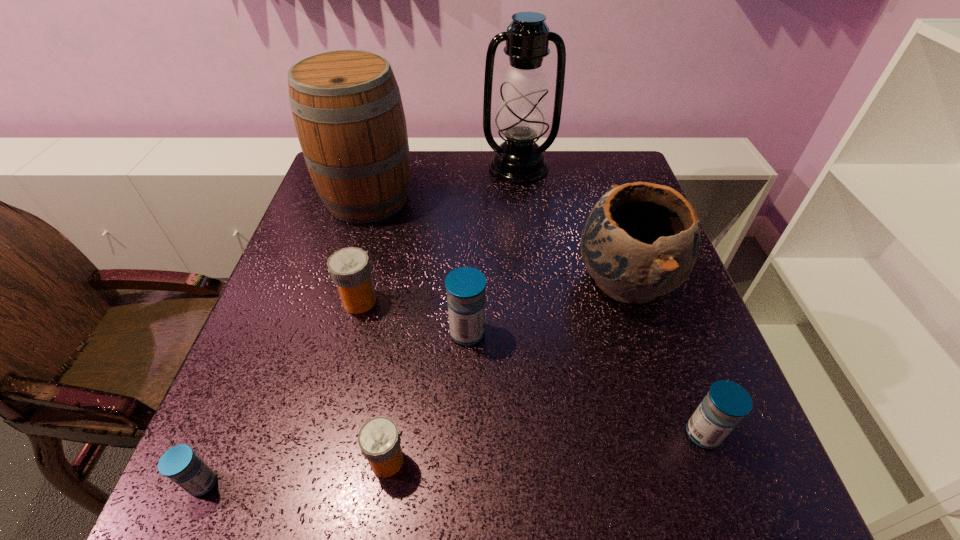
Identify the location of the fifth object from right to left. The height and width of the screenshot is (540, 960). (379, 440).

At what (x,y) coordinates should I click in order to perform the action: click on the right orange medicine. Please return your answer as a coordinate pair (x, y). Looking at the image, I should click on (379, 440).

At what (x,y) coordinates should I click in order to perform the action: click on the smallest blue medicine. Please return your answer as a coordinate pair (x, y). Looking at the image, I should click on (180, 464).

Locate an element on the screen. The width and height of the screenshot is (960, 540). the leftmost blue medicine is located at coordinates (180, 464).

You are a GUI agent. You are given a task and a screenshot of the screen. Output one action in this format:
    pyautogui.click(x=<x>, y=<y>)
    Task: Click on the blank area located 0.150m on the front of the black oil lamp
    This screenshot has height=540, width=960.
    Given the screenshot: What is the action you would take?
    pyautogui.click(x=524, y=218)

Identify the location of vacant space located on the front of the second tallest object. (319, 364).

The image size is (960, 540). I want to click on vacant position located on the back of the blue pottery, so click(588, 164).

This screenshot has height=540, width=960. I want to click on blank area located 0.280m on the back of the biggest blue medicine, so click(469, 231).

At what (x,y) coordinates should I click in order to perform the action: click on vacant space located on the label side of the fourth medicine from right to left. Please return your answer as a coordinate pair (x, y). The height and width of the screenshot is (540, 960). Looking at the image, I should click on (532, 301).

Locate an element on the screen. The height and width of the screenshot is (540, 960). vacant point located on the left of the second farthest blue medicine is located at coordinates (602, 434).